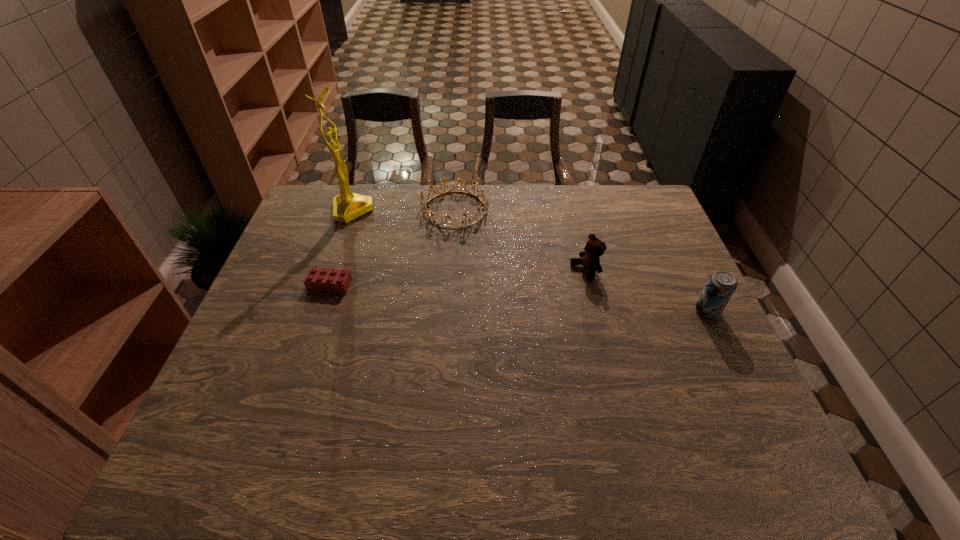
You are a GUI agent. You are given a task and a screenshot of the screen. Output one action in this format:
    pyautogui.click(x=<x>, y=<y>)
    Task: Click on the free space on the desktop that is between the shortest object and the beer can and is positioned on the front-facing side of the fourth tallest object
    
    Given the screenshot: What is the action you would take?
    pyautogui.click(x=506, y=297)

Identify the location of free space on the desktop that is between the Lego and the rightmost object and is positioned on the front-facing side of the second object from right to left. The height and width of the screenshot is (540, 960). (521, 298).

At what (x,y) coordinates should I click in order to perform the action: click on free spot on the desktop that is between the shortest object and the nearest object and is positioned on the front-facing side of the tallest object. Please return your answer as a coordinate pair (x, y). The image size is (960, 540). Looking at the image, I should click on (480, 295).